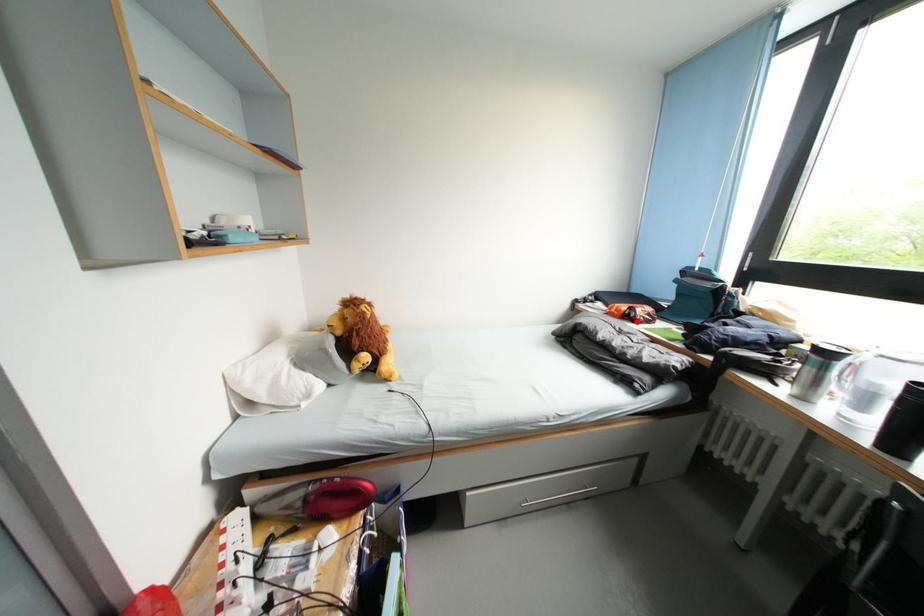
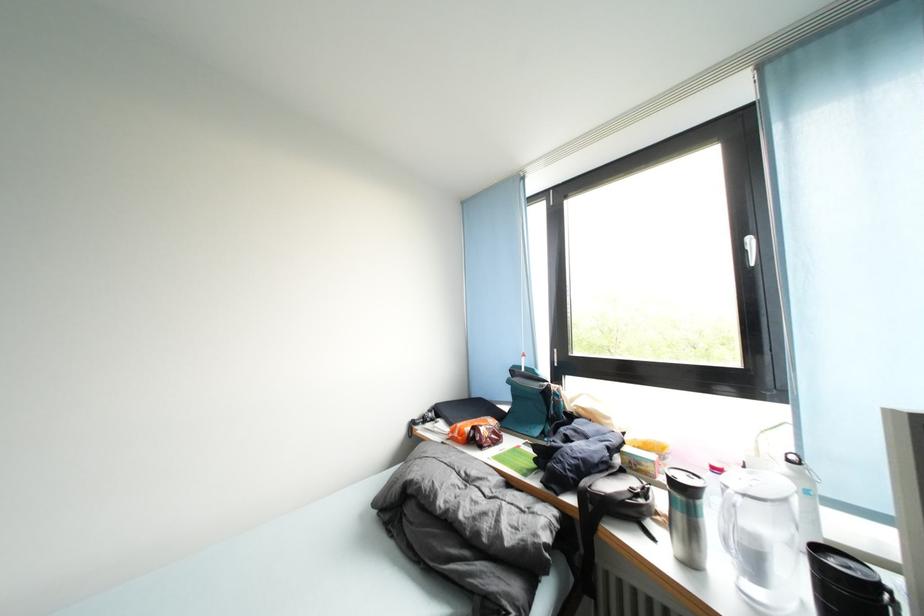
Find the pixel in the second image that matches the highlighted location in the first image.

(482, 446)